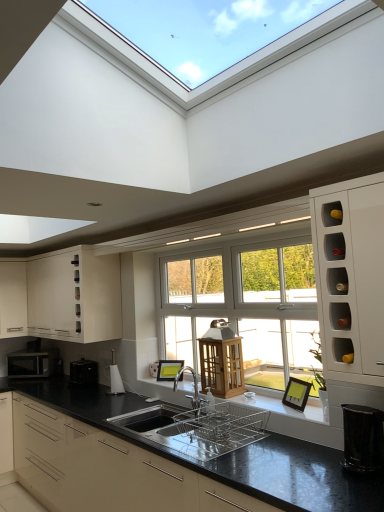
Question: Is there a large distance between white glossy wine rack at right, the 4th cabinetry when ordered from bottom to top, and silver metallic tap at center?

Choices:
 (A) yes
 (B) no

Answer: (A)

Question: Can you confirm if white glossy wine rack at right, the 4th cabinetry when ordered from bottom to top, is shorter than silver metallic tap at center?

Choices:
 (A) yes
 (B) no

Answer: (B)

Question: Is silver metallic tap at center at the back of white glossy wine rack at right, the first cabinetry viewed from the top?

Choices:
 (A) yes
 (B) no

Answer: (B)

Question: Would you say white glossy wine rack at right, the 4th cabinetry when ordered from bottom to top, contains silver metallic tap at center?

Choices:
 (A) yes
 (B) no

Answer: (B)

Question: From a real-world perspective, is white glossy wine rack at right, the 4th cabinetry when ordered from bottom to top, under silver metallic tap at center?

Choices:
 (A) yes
 (B) no

Answer: (B)

Question: Would you say white glossy wine rack at right, the 4th cabinetry when ordered from bottom to top, is outside silver metallic tap at center?

Choices:
 (A) yes
 (B) no

Answer: (A)

Question: From the image's perspective, is silver metallic tap at center on white matte cabinet at left, which is counted as the second cabinetry, starting from the bottom?

Choices:
 (A) no
 (B) yes

Answer: (A)

Question: Is silver metallic tap at center touching white matte cabinet at left, which is the third cabinetry in top-to-bottom order?

Choices:
 (A) yes
 (B) no

Answer: (B)

Question: Is silver metallic tap at center far from white matte cabinet at left, which is the third cabinetry in top-to-bottom order?

Choices:
 (A) no
 (B) yes

Answer: (B)

Question: Is silver metallic tap at center oriented towards white matte cabinet at left, which is counted as the second cabinetry, starting from the bottom?

Choices:
 (A) yes
 (B) no

Answer: (B)

Question: Is silver metallic tap at center bigger than white matte cabinet at left, which is counted as the second cabinetry, starting from the bottom?

Choices:
 (A) no
 (B) yes

Answer: (A)

Question: From the image's perspective, is silver metallic tap at center located beneath white matte cabinet at left, which is counted as the second cabinetry, starting from the bottom?

Choices:
 (A) no
 (B) yes

Answer: (B)

Question: From the image's perspective, is silver metallic microwave at left below white matte cabinet at left, which is the third cabinetry in top-to-bottom order?

Choices:
 (A) yes
 (B) no

Answer: (A)